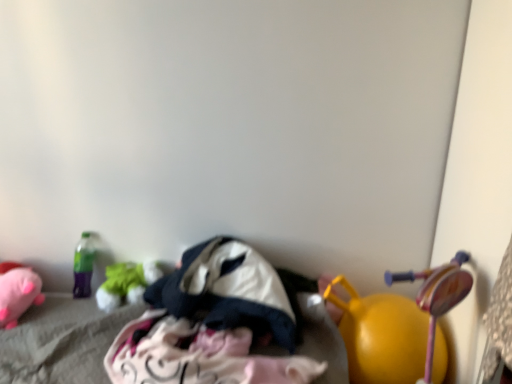
Question: From a real-world perspective, is dark blue fabric at center, the first clothing when ordered from top to bottom, positioned under green fabric toy at left, the second toy in the right-to-left sequence, based on gravity?

Choices:
 (A) yes
 (B) no

Answer: (B)

Question: From the image's perspective, is dark blue fabric at center, acting as the 2th clothing starting from the bottom, over green fabric toy at left, which is the 2th toy from left to right?

Choices:
 (A) no
 (B) yes

Answer: (B)

Question: Considering the relative positions of dark blue fabric at center, acting as the 2th clothing starting from the bottom, and green fabric toy at left, the second toy in the right-to-left sequence, in the image provided, is dark blue fabric at center, acting as the 2th clothing starting from the bottom, in front of green fabric toy at left, the second toy in the right-to-left sequence,?

Choices:
 (A) yes
 (B) no

Answer: (A)

Question: Can you confirm if dark blue fabric at center, the first clothing when ordered from top to bottom, is positioned to the right of green fabric toy at left, which is the 2th toy from left to right?

Choices:
 (A) no
 (B) yes

Answer: (B)

Question: Would you say dark blue fabric at center, the first clothing when ordered from top to bottom, is outside green fabric toy at left, which is the 2th toy from left to right?

Choices:
 (A) yes
 (B) no

Answer: (A)

Question: From their relative heights in the image, would you say white cotton clothes at center, marked as the 2th clothing in a top-to-bottom arrangement, is taller or shorter than soft pink plush at lower left, the first toy from the left?

Choices:
 (A) tall
 (B) short

Answer: (A)

Question: Does point (239, 352) appear closer or farther from the camera than point (13, 321)?

Choices:
 (A) closer
 (B) farther

Answer: (A)

Question: Is white cotton clothes at center, which appears as the first clothing when ordered from the bottom, spatially inside soft pink plush at lower left, the first toy from the left, or outside of it?

Choices:
 (A) outside
 (B) inside

Answer: (A)

Question: From a real-world perspective, is white cotton clothes at center, which appears as the first clothing when ordered from the bottom, physically located above or below soft pink plush at lower left, placed as the third toy when sorted from right to left?

Choices:
 (A) below
 (B) above

Answer: (B)

Question: Is point (32, 299) closer or farther from the camera than point (164, 279)?

Choices:
 (A) farther
 (B) closer

Answer: (B)

Question: Is soft pink plush at lower left, the first toy from the left, situated inside dark blue fabric at center, the first clothing when ordered from top to bottom, or outside?

Choices:
 (A) inside
 (B) outside

Answer: (B)

Question: Is soft pink plush at lower left, placed as the third toy when sorted from right to left, taller or shorter than dark blue fabric at center, the first clothing when ordered from top to bottom?

Choices:
 (A) tall
 (B) short

Answer: (B)

Question: From a real-world perspective, is soft pink plush at lower left, placed as the third toy when sorted from right to left, above or below dark blue fabric at center, the first clothing when ordered from top to bottom?

Choices:
 (A) above
 (B) below

Answer: (B)

Question: Is yellow rubber ball at lower right, arranged as the 3th toy when viewed from the left, taller or shorter than dark blue fabric at center, acting as the 2th clothing starting from the bottom?

Choices:
 (A) short
 (B) tall

Answer: (B)

Question: From the image's perspective, is yellow rubber ball at lower right, placed as the first toy when sorted from right to left, positioned above or below dark blue fabric at center, acting as the 2th clothing starting from the bottom?

Choices:
 (A) above
 (B) below

Answer: (B)